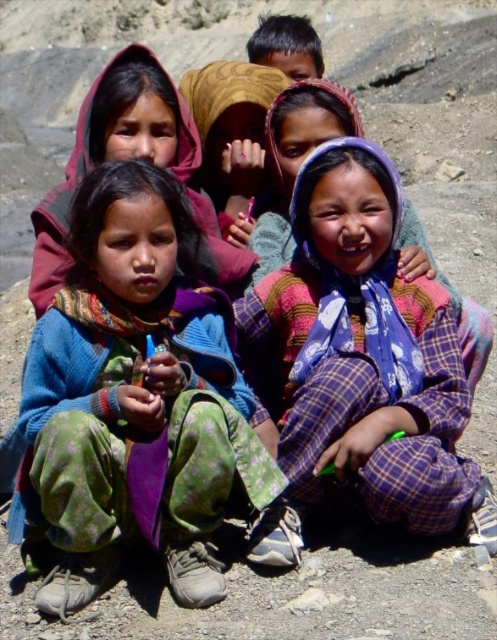
Is blue knitted sweater at center positioned behind dark brown hair at upper center?

No, it is in front of dark brown hair at upper center.

Between point (205, 481) and point (282, 70), which one is positioned in front?

Point (205, 481) is in front.

Find the location of `blue knitted sweater at center`. blue knitted sweater at center is located at coordinates (139, 404).

Is blue knitted sweater at center positioned at the back of plaid fabric child at center?

No, it is in front of plaid fabric child at center.

Is point (105, 211) positioned in front of point (386, 442)?

No, (105, 211) is behind (386, 442).

The width and height of the screenshot is (497, 640). Identify the location of blue knitted sweater at center. (139, 404).

Which is in front, point (352, 413) or point (270, 38)?

Point (352, 413) is in front.

Who is taller, plaid fabric child at center or dark brown hair at upper center?

Standing taller between the two is dark brown hair at upper center.

At what (x,y) coordinates should I click in order to perform the action: click on plaid fabric child at center. Please return your answer as a coordinate pair (x, y). Image resolution: width=497 pixels, height=640 pixels. Looking at the image, I should click on (362, 356).

The height and width of the screenshot is (640, 497). Find the location of `plaid fabric child at center`. plaid fabric child at center is located at coordinates (362, 356).